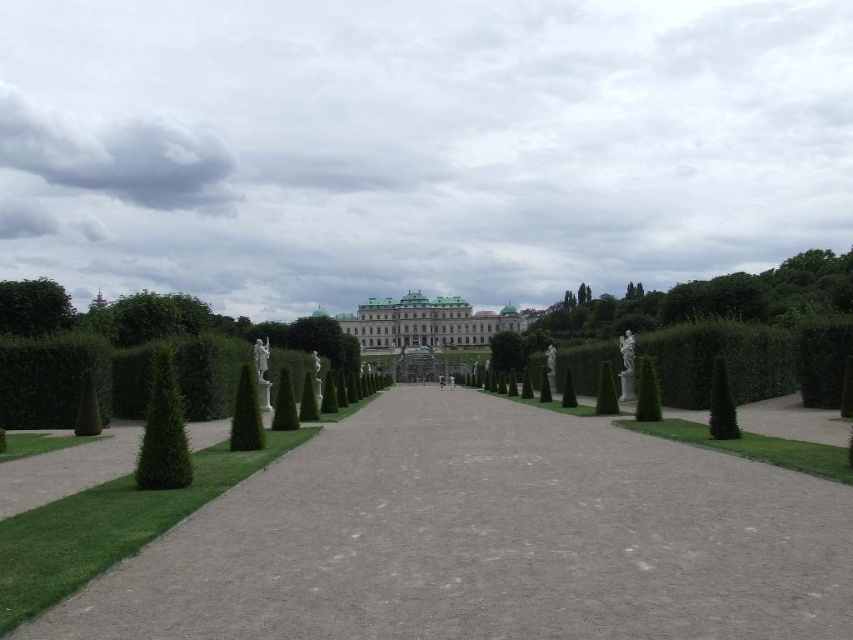
Question: Estimate the real-world distances between objects in this image. Which object is closer to the white stone palace at center?

Choices:
 (A) gray gravel path at center
 (B) green hedge at center
 (C) green textured bush at center-right

Answer: (B)

Question: Can you confirm if green leafy hedge at left is positioned to the left of green leafy tree at left?

Choices:
 (A) no
 (B) yes

Answer: (A)

Question: Can you confirm if white stone palace at center is bigger than green textured bush at center?

Choices:
 (A) yes
 (B) no

Answer: (A)

Question: Among these points, which one is nearest to the camera?

Choices:
 (A) (415, 332)
 (B) (276, 387)

Answer: (B)

Question: Which object is positioned closest to the green leafy tree at left?

Choices:
 (A) green textured bush at left
 (B) green leafy hedge at left
 (C) white stone palace at center

Answer: (B)

Question: Can you confirm if green leafy tree at left is positioned to the right of green leafy bush at center-right?

Choices:
 (A) no
 (B) yes

Answer: (A)